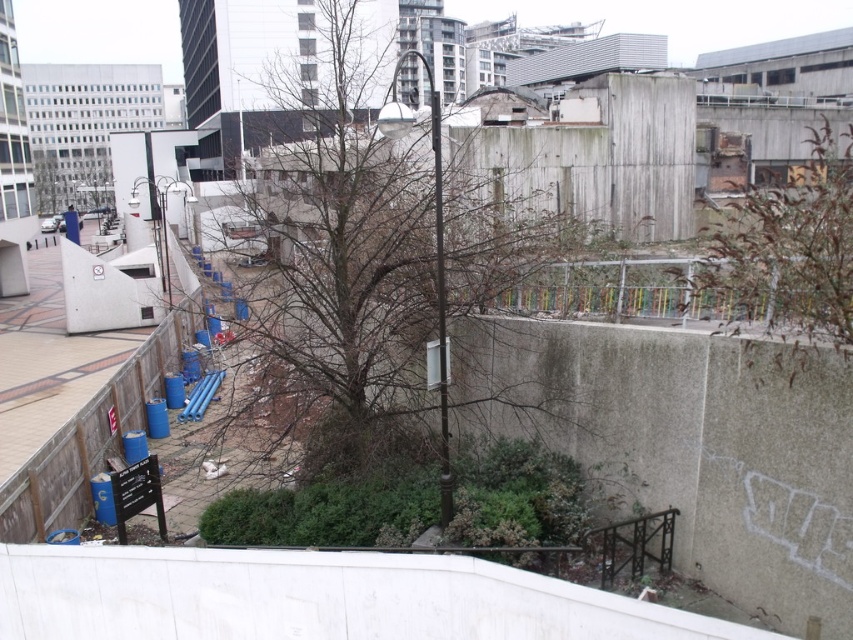
Question: Among these points, which one is farthest from the camera?

Choices:
 (A) (821, 260)
 (B) (57, 177)
 (C) (267, 352)

Answer: (B)

Question: Among these objects, which one is nearest to the camera?

Choices:
 (A) green leafy tree at upper left
 (B) bare branches at center
 (C) brown leafless tree at upper left

Answer: (B)

Question: Is bare branches at center behind brown leafless tree at upper left?

Choices:
 (A) no
 (B) yes

Answer: (A)

Question: Considering the real-world distances, which object is closest to the brown leafless tree at upper left?

Choices:
 (A) green leafy tree at upper left
 (B) bare branches at center

Answer: (A)

Question: Is bare branches at center thinner than brown leafless tree at upper left?

Choices:
 (A) no
 (B) yes

Answer: (A)

Question: Does bare branches at center have a smaller size compared to green leafy tree at upper left?

Choices:
 (A) yes
 (B) no

Answer: (B)